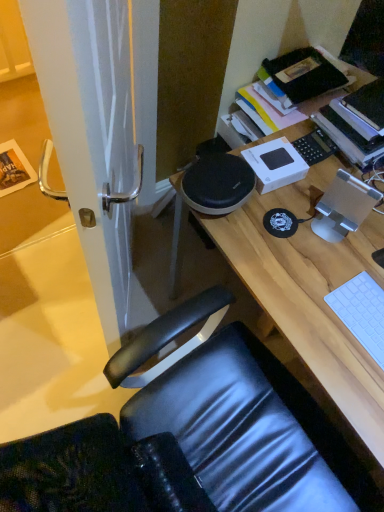
Locate an element on the screen. The width and height of the screenshot is (384, 512). white glossy door handle at left is located at coordinates (92, 135).

Where is `white matte keyboard at lower right`? This screenshot has width=384, height=512. white matte keyboard at lower right is located at coordinates (362, 312).

The width and height of the screenshot is (384, 512). Identify the location of white glossy door handle at left. (92, 135).

From the image's perspective, would you say wooden desk at center is shown under white matte keyboard at lower right?

Yes, from the image's perspective, wooden desk at center is below white matte keyboard at lower right.

Considering the relative positions of wooden desk at center and white matte keyboard at lower right in the image provided, is wooden desk at center in front of white matte keyboard at lower right?

Yes, it is.

Are wooden desk at center and white matte keyboard at lower right far apart?

wooden desk at center is near white matte keyboard at lower right, not far away.

Measure the distance from wooden desk at center to white matte keyboard at lower right.

wooden desk at center is 5.80 inches from white matte keyboard at lower right.

Is white glossy door handle at left not near wooden desk at center?

No, white glossy door handle at left is in close proximity to wooden desk at center.

Who is shorter, white glossy door handle at left or wooden desk at center?

With less height is wooden desk at center.

Does white glossy door handle at left lie behind wooden desk at center?

No, it is not.

Is white glossy door handle at left oriented away from wooden desk at center?

Absolutely, white glossy door handle at left is directed away from wooden desk at center.

Does hardcover book at upper right touch wooden desk at center?

They are not placed beside each other.

In order to click on book that appears above the wooden desk at center (from a real-world perspective) in this screenshot , I will do `click(349, 133)`.

Is hardcover book at upper right positioned in front of wooden desk at center?

No, hardcover book at upper right is behind wooden desk at center.

Considering the sizes of objects wooden desk at center and white glossy door handle at left in the image provided, who is smaller, wooden desk at center or white glossy door handle at left?

With smaller size is white glossy door handle at left.

Which point is more forward, (269, 237) or (106, 277)?

Point (106, 277)

Can white glossy door handle at left be found inside wooden desk at center?

No, white glossy door handle at left is not inside wooden desk at center.

The height and width of the screenshot is (512, 384). I want to click on screen door that appears in front of the wooden desk at center, so tap(92, 135).

From the image's perspective, which object appears higher, white matte keyboard at lower right or white glossy door handle at left?

white glossy door handle at left, from the image's perspective.

The width and height of the screenshot is (384, 512). In order to click on laptop keyboard on the right of the white glossy door handle at left in this screenshot , I will do `click(362, 312)`.

Is white matte keyboard at lower right not close to white glossy door handle at left?

No, there isn't a large distance between white matte keyboard at lower right and white glossy door handle at left.

What's the angular difference between white matte keyboard at lower right and white glossy door handle at left's facing directions?

The angle between the facing direction of white matte keyboard at lower right and the facing direction of white glossy door handle at left is 31.1 degrees.

Between point (355, 323) and point (298, 302), which one is positioned behind?

The point (298, 302) is behind.

From the picture: Which of these two, white matte keyboard at lower right or wooden desk at center, stands taller?

wooden desk at center is taller.

Is white matte keyboard at lower right aimed at wooden desk at center?

No, white matte keyboard at lower right is not facing towards wooden desk at center.

Who is taller, white matte keyboard at lower right or hardcover book at upper right?

Standing taller between the two is hardcover book at upper right.

Consider the image. Considering the sizes of objects white matte keyboard at lower right and hardcover book at upper right in the image provided, who is thinner, white matte keyboard at lower right or hardcover book at upper right?

white matte keyboard at lower right is thinner.

This screenshot has width=384, height=512. Identify the location of desk located underneath the white matte keyboard at lower right (from a real-world perspective). (310, 292).

Locate an element on the screen. The height and width of the screenshot is (512, 384). desk located behind the white glossy door handle at left is located at coordinates (310, 292).

Considering their positions, is hardcover book at upper right positioned further to white glossy door handle at left than white matte keyboard at lower right?

Among the two, hardcover book at upper right is located further to white glossy door handle at left.

Looking at the image, which one is located closer to wooden desk at center, hardcover book at upper right or white matte keyboard at lower right?

white matte keyboard at lower right lies closer to wooden desk at center than the other object.

From the image, which object appears to be farther from wooden desk at center, white glossy door handle at left or hardcover book at upper right?

white glossy door handle at left.

Looking at the image, which one is located further to white glossy door handle at left, white matte keyboard at lower right or hardcover book at upper right?

hardcover book at upper right.

Looking at this image, from the image, which object appears to be nearer to white matte keyboard at lower right, white glossy door handle at left or hardcover book at upper right?

The object closer to white matte keyboard at lower right is hardcover book at upper right.

Looking at the image, which one is located closer to white glossy door handle at left, wooden desk at center or hardcover book at upper right?

The object closer to white glossy door handle at left is wooden desk at center.

Looking at the image, which one is located further to wooden desk at center, white glossy door handle at left or white matte keyboard at lower right?

white glossy door handle at left.

Considering their positions, is white matte keyboard at lower right positioned closer to white glossy door handle at left than wooden desk at center?

wooden desk at center.

Where is `laptop keyboard located between white glossy door handle at left and wooden desk at center in the left-right direction`? laptop keyboard located between white glossy door handle at left and wooden desk at center in the left-right direction is located at coordinates (362, 312).

Identify the location of laptop keyboard between white glossy door handle at left and hardcover book at upper right from left to right. (362, 312).

In order to click on book located between white glossy door handle at left and wooden desk at center in the left-right direction in this screenshot , I will do `click(349, 133)`.

The width and height of the screenshot is (384, 512). What are the coordinates of `laptop keyboard between hardcover book at upper right and wooden desk at center from top to bottom` in the screenshot? It's located at (362, 312).